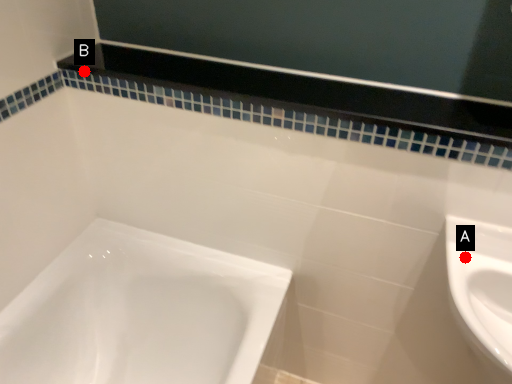
Question: Two points are circled on the image, labeled by A and B beside each circle. Which point is farther to the camera?

Choices:
 (A) A is further
 (B) B is further

Answer: (B)